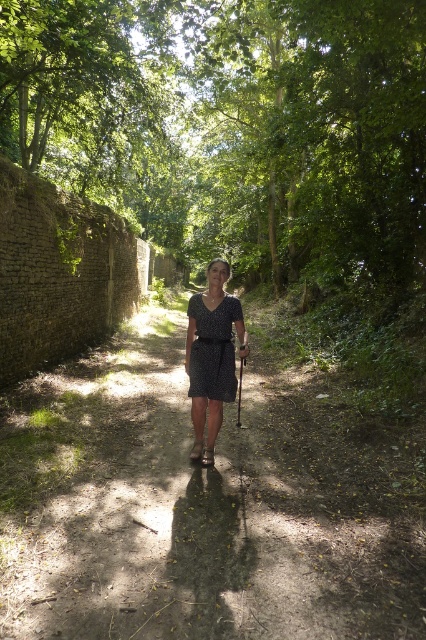
You are a fashion designer observing two dresses in an outdoor setting. The scene shows a dark dotted dress at center and a black dotted dress at center. Which dress appears taller in the image?

The dark dotted dress at center appears much taller than the black dotted dress at center in the image.

You are a hiker who wants to take a photo of the green leafy tree at center and the black dotted dress at center from a distance where both are fully visible in the frame. What is the minimum distance you need to stand away from them to capture both in a single photo?

The minimum distance you need to stand away from the green leafy tree at center and the black dotted dress at center is 56.23 feet to ensure both are fully visible in the frame.

You are standing on the narrow dirt path and see the green leafy tree at center and the black dotted dress at center. Which object is located to the right of the other?

The green leafy tree at center is positioned on the right side of black dotted dress at center, so the tree is to the right of the dress.